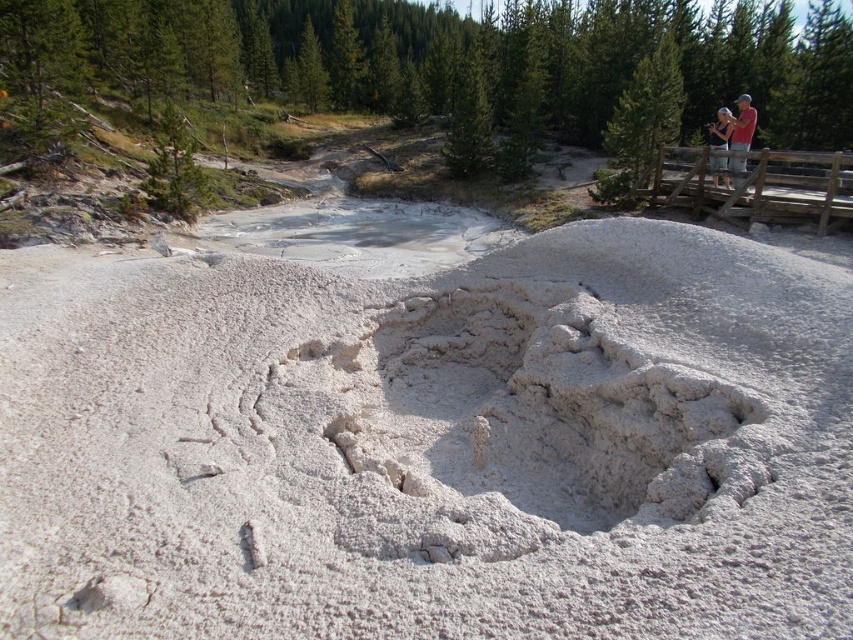
You are a hiker wearing a red shirt at upper right and you want to take a sample from the white powdery mound at center. Can you reach it without moving from your current position?

The white powdery mound at center is closer to the viewer than the red shirt at upper right, so yes, you can reach it without moving from your current position.

You are standing at the point labeled as point (440, 449) in the geothermal area. What is the terrain like at your current location?

The terrain at point (440, 449) is a large, irregularly shaped mound of white, powdery material, possibly mineral deposits or salt formations, formed through natural processes like evaporation or volcanic activity. The texture is rough and uneven with some areas more compacted than others.

You are a photographer positioned at the camera location. You want to capture both point A at point (x=735, y=120) and point B at point (x=718, y=163) in your shot. Which point will appear closer to the front of the image?

Point A at point (x=735, y=120) will appear closer to the front of the image because it is further to the camera than point B at point (x=718, y=163).